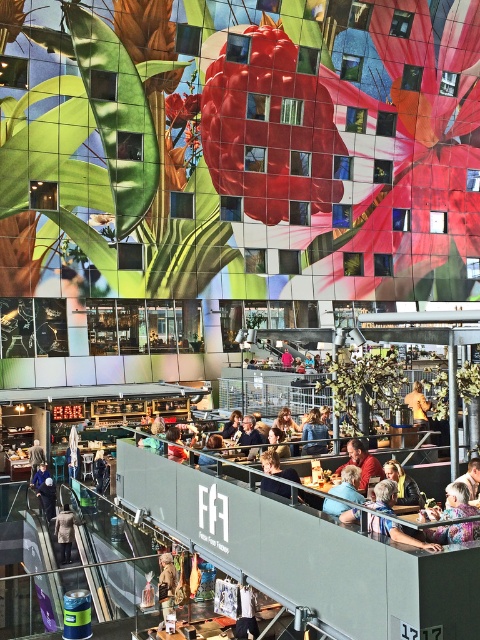
You are a customer standing at the entrance of the mall. You see the green metallic plant at center and the dark gray wool coat at lower left. Which object is shorter?

The green metallic plant at center is shorter than the dark gray wool coat at lower left.

You are a customer in this mall and you want to take a photo of the green metallic plant at center and the matte red shirt at center. Which object should you focus on first if you want to capture both in the same frame without moving your camera?

You should focus on the matte red shirt at center first because the green metallic plant at center is to the right of it, allowing both to be captured in the same frame by centering the shirt and including the plant to its right.

You are a photographer trying to capture a candid shot of both the golden hair at upper center and the blue denim jacket at center. Considering their sizes in the frame, which object should you focus on first to ensure both are in the shot?

Since the golden hair at upper center occupies less space than the blue denim jacket at center, you should focus on the blue denim jacket at center first as it takes up more space and will require more attention to frame properly, ensuring both elements fit into the shot.